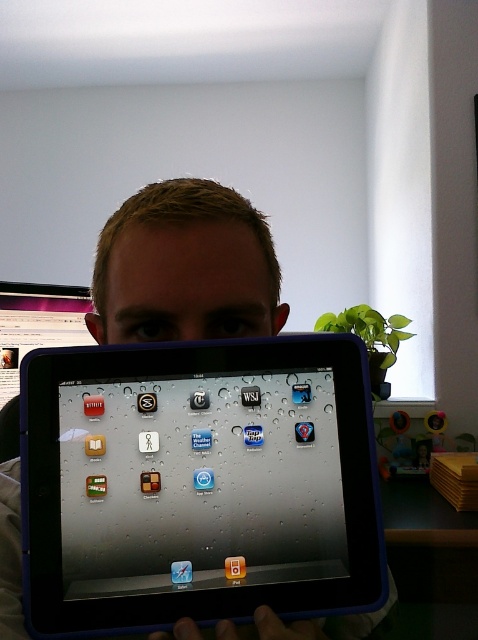
Between satin black tablet at center and matte skin at center, which one has less height?

matte skin at center

Is satin black tablet at center to the left of matte skin at center from the viewer's perspective?

Incorrect, satin black tablet at center is not on the left side of matte skin at center.

Identify the location of satin black tablet at center. Image resolution: width=478 pixels, height=640 pixels. (197, 486).